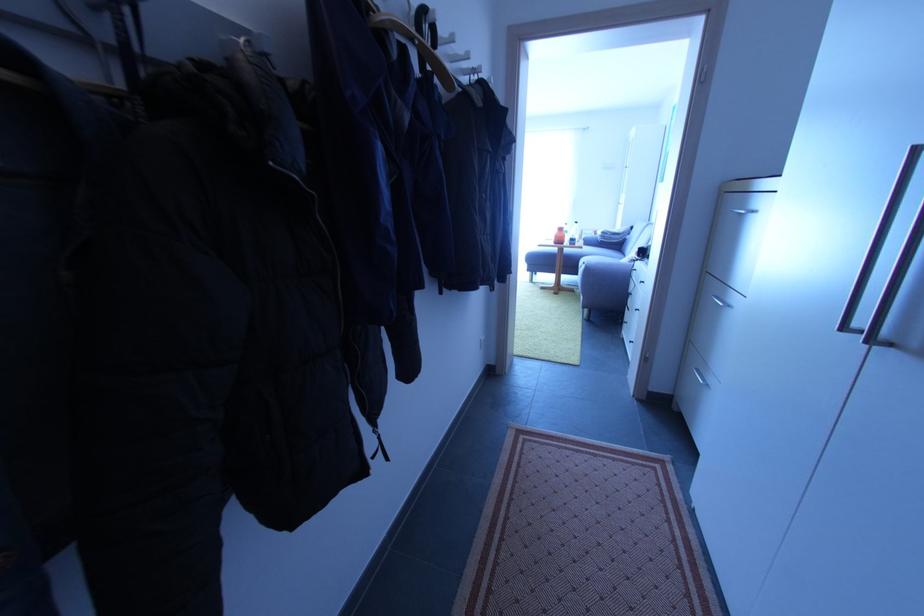
Image resolution: width=924 pixels, height=616 pixels. I want to click on sofa sitting surface, so click(564, 257).